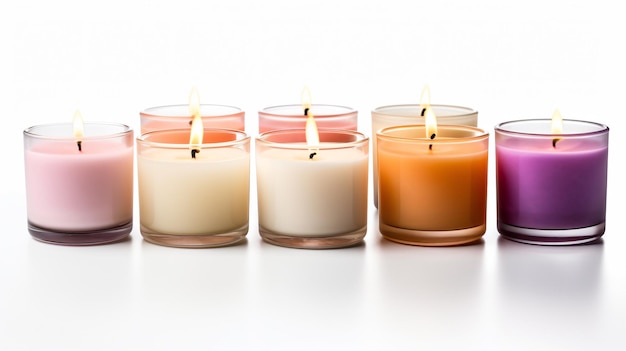
The image size is (626, 351). What are the coordinates of `glass jars` in the screenshot? It's located at (100, 241), (193, 243), (292, 241), (453, 234), (548, 237), (384, 116), (342, 116), (239, 117).